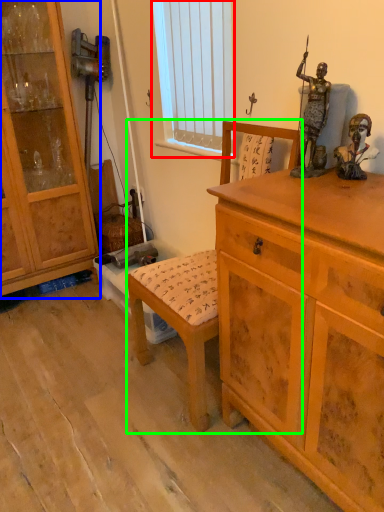
Question: Estimate the real-world distances between objects in this image. Which object is farther from window screen (highlighted by a red box), cabinetry (highlighted by a blue box) or rocking chair (highlighted by a green box)?

Choices:
 (A) cabinetry
 (B) rocking chair

Answer: (B)